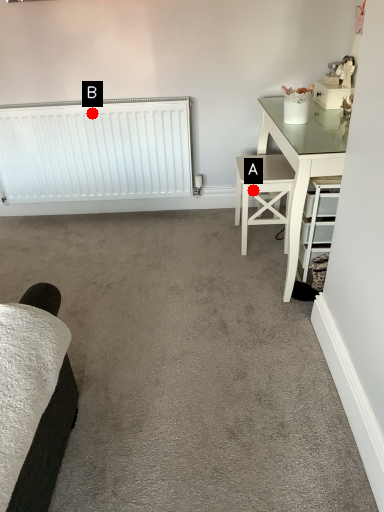
Question: Two points are circled on the image, labeled by A and B beside each circle. Which point is farther from the camera taking this photo?

Choices:
 (A) A is further
 (B) B is further

Answer: (B)